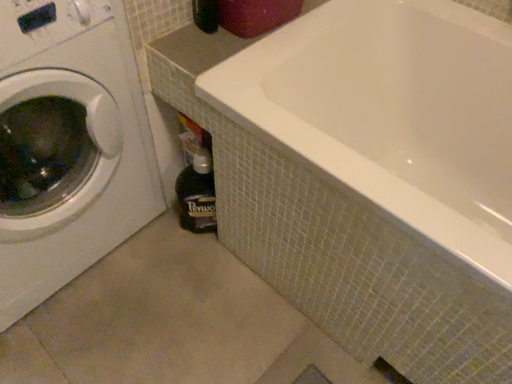
Question: Is white glossy washing machine at left not inside dark brown glass bottle at lower center?

Choices:
 (A) yes
 (B) no

Answer: (A)

Question: Considering the relative sizes of white glossy washing machine at left and dark brown glass bottle at lower center in the image provided, is white glossy washing machine at left thinner than dark brown glass bottle at lower center?

Choices:
 (A) no
 (B) yes

Answer: (A)

Question: Is white glossy washing machine at left closer to camera compared to dark brown glass bottle at lower center?

Choices:
 (A) yes
 (B) no

Answer: (A)

Question: From a real-world perspective, is white glossy washing machine at left on top of dark brown glass bottle at lower center?

Choices:
 (A) yes
 (B) no

Answer: (A)

Question: Is white glossy washing machine at left not close to dark brown glass bottle at lower center?

Choices:
 (A) yes
 (B) no

Answer: (B)

Question: From a real-world perspective, is white glossy washing machine at left physically below dark brown glass bottle at lower center?

Choices:
 (A) no
 (B) yes

Answer: (A)

Question: From the image's perspective, does white glossy bathtub at center appear lower than dark brown glass bottle at lower center?

Choices:
 (A) yes
 (B) no

Answer: (B)

Question: Is white glossy bathtub at center to the left of dark brown glass bottle at lower center from the viewer's perspective?

Choices:
 (A) yes
 (B) no

Answer: (B)

Question: From a real-world perspective, is white glossy bathtub at center beneath dark brown glass bottle at lower center?

Choices:
 (A) no
 (B) yes

Answer: (A)

Question: Is white glossy bathtub at center oriented away from dark brown glass bottle at lower center?

Choices:
 (A) yes
 (B) no

Answer: (B)

Question: Is white glossy bathtub at center shorter than dark brown glass bottle at lower center?

Choices:
 (A) no
 (B) yes

Answer: (A)

Question: Are white glossy bathtub at center and dark brown glass bottle at lower center far apart?

Choices:
 (A) yes
 (B) no

Answer: (B)

Question: Is dark brown glass bottle at lower center to the left of white glossy washing machine at left from the viewer's perspective?

Choices:
 (A) no
 (B) yes

Answer: (A)